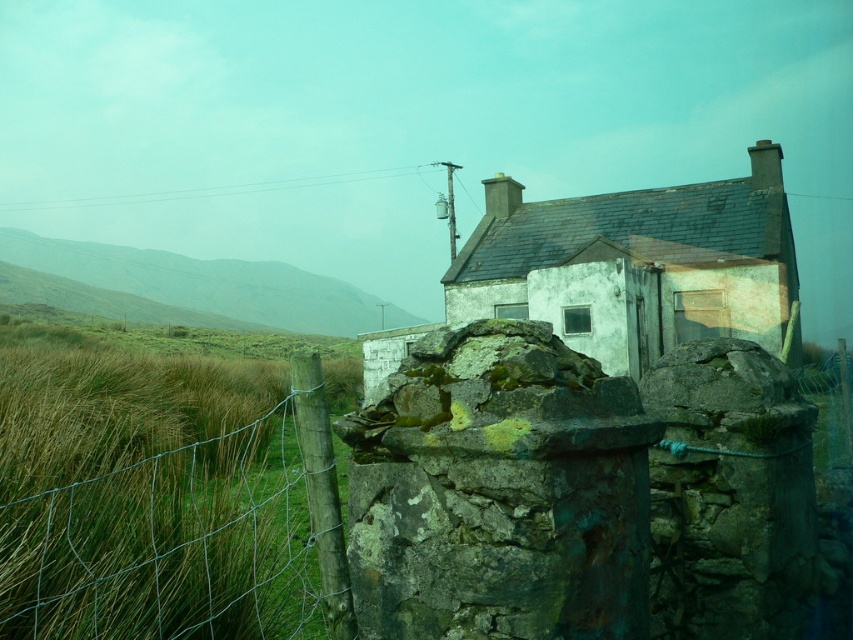
Between green wire fence at left and green grassy hillside at left, which one is positioned higher?

green grassy hillside at left is higher up.

Is point (20, 577) positioned behind point (39, 241)?

No, it is in front of (39, 241).

At what (x,y) coordinates should I click in order to perform the action: click on green wire fence at left. Please return your answer as a coordinate pair (x, y). The image size is (853, 640). Looking at the image, I should click on (149, 499).

Is point (474, 248) closer to viewer compared to point (183, 305)?

That is True.

Locate an element on the screen. white stone cottage at center is located at coordinates tap(635, 262).

Between green wire fence at left and white stone cottage at center, which one is positioned higher?

Positioned higher is white stone cottage at center.

Does point (16, 369) lie behind point (689, 276)?

That is False.

Does point (44, 353) come behind point (572, 298)?

That is False.

I want to click on green wire fence at left, so click(149, 499).